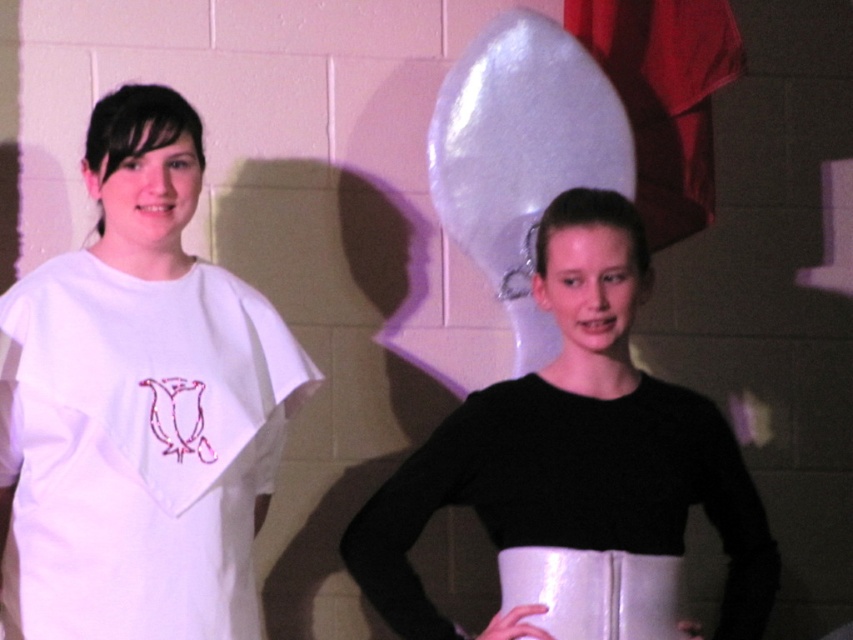
Based on the scene description, what are the coordinates of the black matte sweater at center?

The coordinates of the black matte sweater at center are at point (575, 444).

You are a delivery person who needs to place a package between the black matte sweater at center and the white glossy apron at lower center. The package is 6 inches long. Can you fit it in the space between them?

The distance between the black matte sweater at center and the white glossy apron at lower center is 6.02 inches, so the 6 inch package can fit in the space between them.

You are standing in a room and see the black matte sweater at center. If you take a step forward, will you be closer to the sweater than 1.5 meters?

The black matte sweater at center is currently 1.68 meters away from the viewer. If you take a step forward, you would reduce the distance, so yes, you would be closer than 1.5 meters.